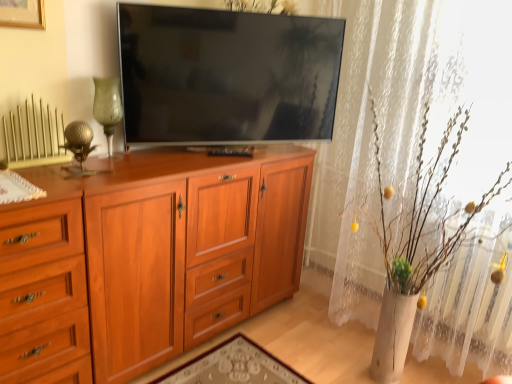
You are a GUI agent. You are given a task and a screenshot of the screen. Output one action in this format:
    pyautogui.click(x=<x>, y=<y>)
    Task: Click on the vacant area on top of light brown wood drawer at left (from a real-world perspective)
    This screenshot has width=512, height=384.
    Given the screenshot: What is the action you would take?
    pyautogui.click(x=21, y=175)